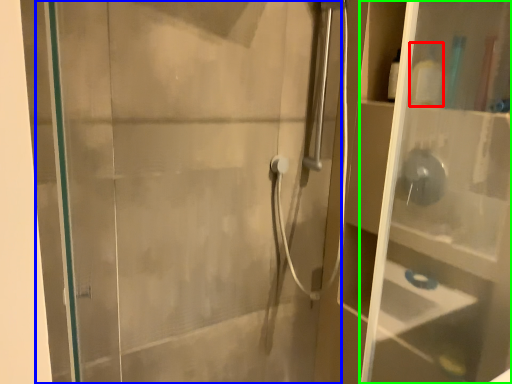
Question: Estimate the real-world distances between objects in this image. Which object is farther from toiletry (highlighted by a red box), screen door (highlighted by a blue box) or glass box (highlighted by a green box)?

Choices:
 (A) screen door
 (B) glass box

Answer: (A)